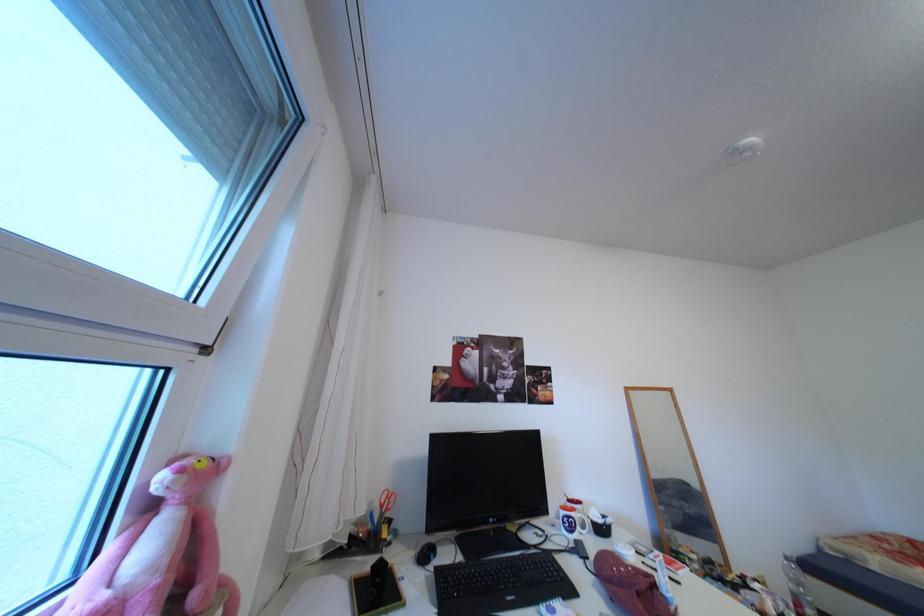
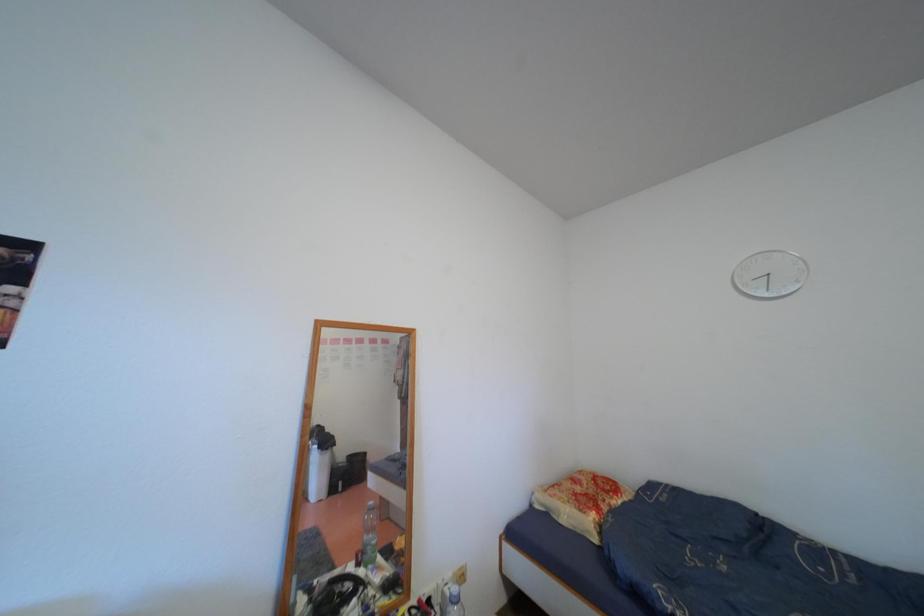
What movement of the cameraman would produce the second image?

The movement direction of the cameraman is right, forward.